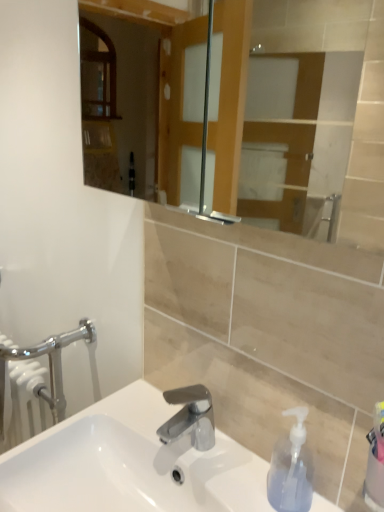
Locate an element on the screen. The image size is (384, 512). vacant space behind chrome metallic faucet at center is located at coordinates (157, 414).